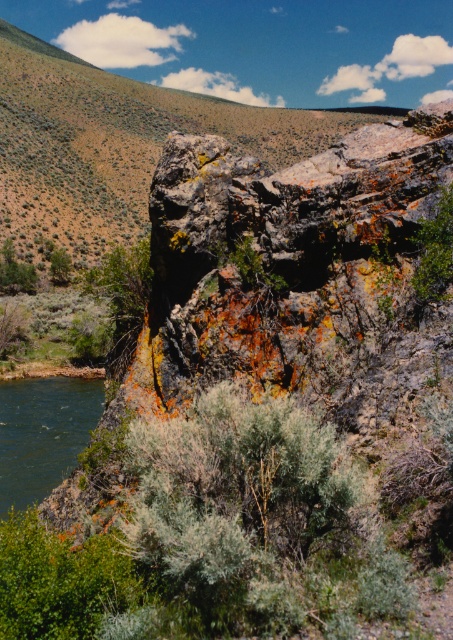
You are standing in the rugged landscape and want to cross to the dark green water at lower left. There is a green leafy shrub at left in your way. Which direction should you move to avoid the shrub and reach the water?

You should move to the right of the green leafy shrub at left because the dark green water at lower left is located to the right of the shrub.

You are standing on the edge of the dark green water at lower left and want to reach the green leafy shrub at center. Which direction should you move to get closer to the shrub?

The dark green water at lower left is much taller than the green leafy shrub at center, so you should move upward to reach the green leafy shrub at center.